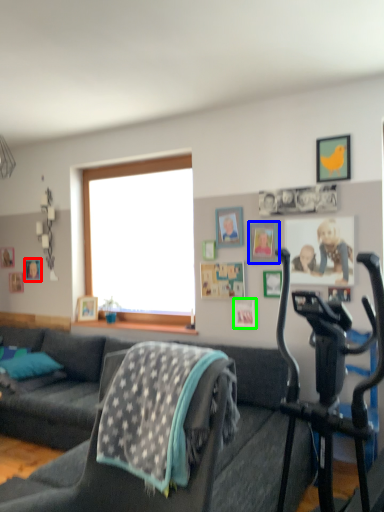
Question: Considering the real-world distances, which object is closest to picture frame (highlighted by a red box)? picture frame (highlighted by a blue box) or picture frame (highlighted by a green box).

Choices:
 (A) picture frame
 (B) picture frame

Answer: (B)